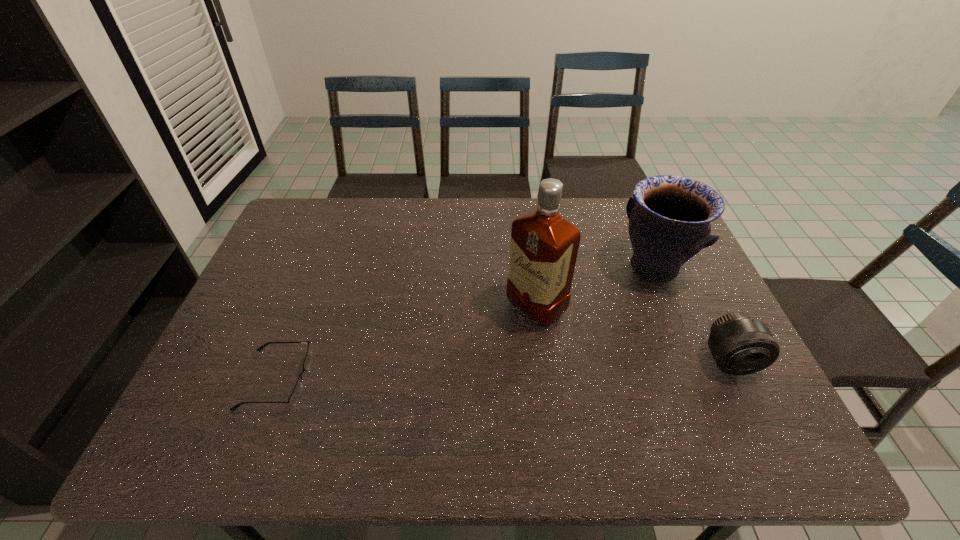
In the image, there is a desktop. Where is `blank space at the far edge`? blank space at the far edge is located at coordinates (503, 229).

At what (x,y) coordinates should I click in order to perform the action: click on vacant space at the near edge of the desktop. Please return your answer as a coordinate pair (x, y). The width and height of the screenshot is (960, 540). Looking at the image, I should click on (465, 389).

In the image, there is a desktop. Where is `vacant space at the left edge`? The image size is (960, 540). vacant space at the left edge is located at coordinates (307, 285).

Where is `vacant area at the right edge of the desktop`? vacant area at the right edge of the desktop is located at coordinates (669, 297).

Locate an element on the screen. This screenshot has width=960, height=540. free region at the near right corner is located at coordinates (730, 389).

Find the location of a particular element. Image resolution: width=960 pixels, height=540 pixels. vacant space that is in between the liquor and the third tallest object is located at coordinates (633, 334).

This screenshot has height=540, width=960. What are the coordinates of `vacant space that's between the telephoto lens and the tallest object` in the screenshot? It's located at (633, 334).

Find the location of `vacant area that lies between the second shortest object and the third shortest object`. vacant area that lies between the second shortest object and the third shortest object is located at coordinates (691, 314).

Image resolution: width=960 pixels, height=540 pixels. In order to click on vacant space that is in between the second shortest object and the spectacles in this screenshot , I will do `click(503, 370)`.

Locate an element on the screen. empty space that is in between the leftmost object and the telephoto lens is located at coordinates (503, 370).